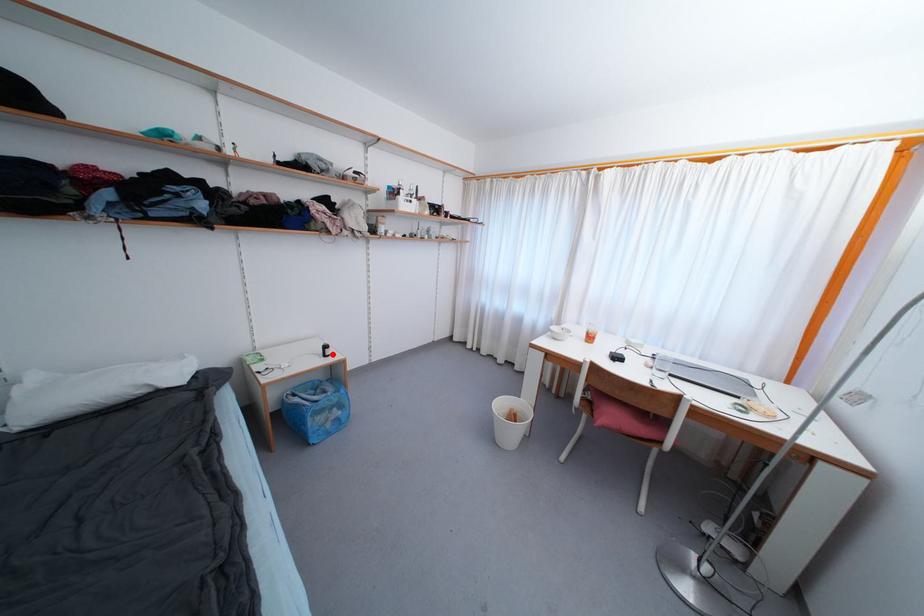
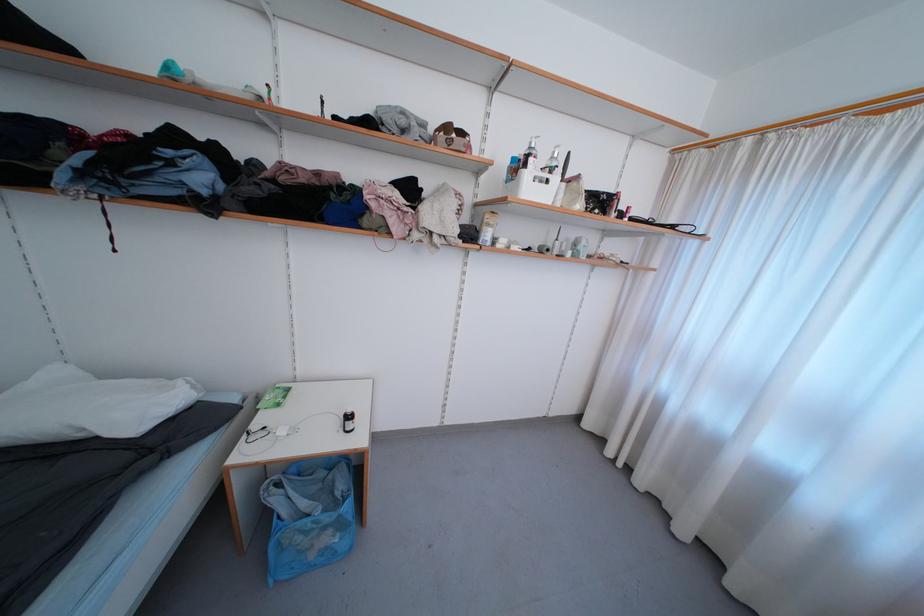
In the second image, find the point that corresponds to the highlighted location in the first image.

(354, 429)